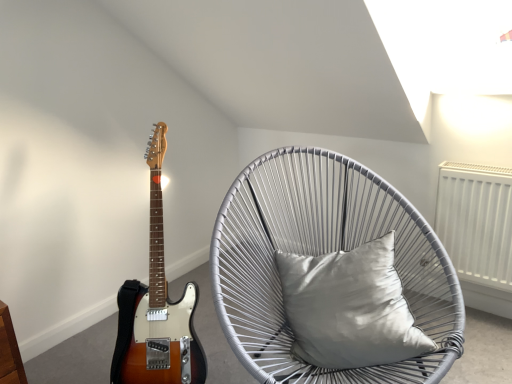
Question: Can you confirm if silver woven chair with cushion at center is taller than satin silver pillow at center?

Choices:
 (A) no
 (B) yes

Answer: (B)

Question: Does silver woven chair with cushion at center have a larger size compared to satin silver pillow at center?

Choices:
 (A) no
 (B) yes

Answer: (B)

Question: Does silver woven chair with cushion at center appear on the left side of satin silver pillow at center?

Choices:
 (A) no
 (B) yes

Answer: (B)

Question: From the image's perspective, is silver woven chair with cushion at center under satin silver pillow at center?

Choices:
 (A) yes
 (B) no

Answer: (A)

Question: Would you say silver woven chair with cushion at center is outside satin silver pillow at center?

Choices:
 (A) yes
 (B) no

Answer: (A)

Question: Considering the relative sizes of silver woven chair with cushion at center and satin silver pillow at center in the image provided, is silver woven chair with cushion at center wider than satin silver pillow at center?

Choices:
 (A) no
 (B) yes

Answer: (B)

Question: Is satin silver pillow at center in contact with silver woven chair with cushion at center?

Choices:
 (A) no
 (B) yes

Answer: (A)

Question: Considering the relative positions of satin silver pillow at center and silver woven chair with cushion at center in the image provided, is satin silver pillow at center behind silver woven chair with cushion at center?

Choices:
 (A) no
 (B) yes

Answer: (B)

Question: Does satin silver pillow at center turn towards silver woven chair with cushion at center?

Choices:
 (A) no
 (B) yes

Answer: (B)

Question: Is satin silver pillow at center positioned before silver woven chair with cushion at center?

Choices:
 (A) yes
 (B) no

Answer: (B)

Question: From the image's perspective, would you say satin silver pillow at center is shown under silver woven chair with cushion at center?

Choices:
 (A) yes
 (B) no

Answer: (B)

Question: Can you confirm if satin silver pillow at center is shorter than silver woven chair with cushion at center?

Choices:
 (A) yes
 (B) no

Answer: (A)

Question: Is satin silver pillow at center inside satin wood guitar at left?

Choices:
 (A) no
 (B) yes

Answer: (A)